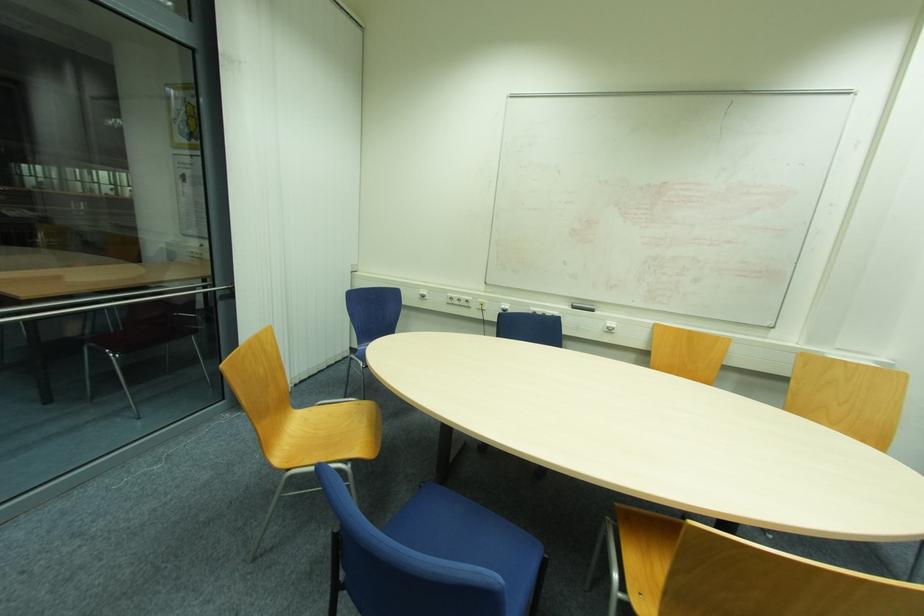
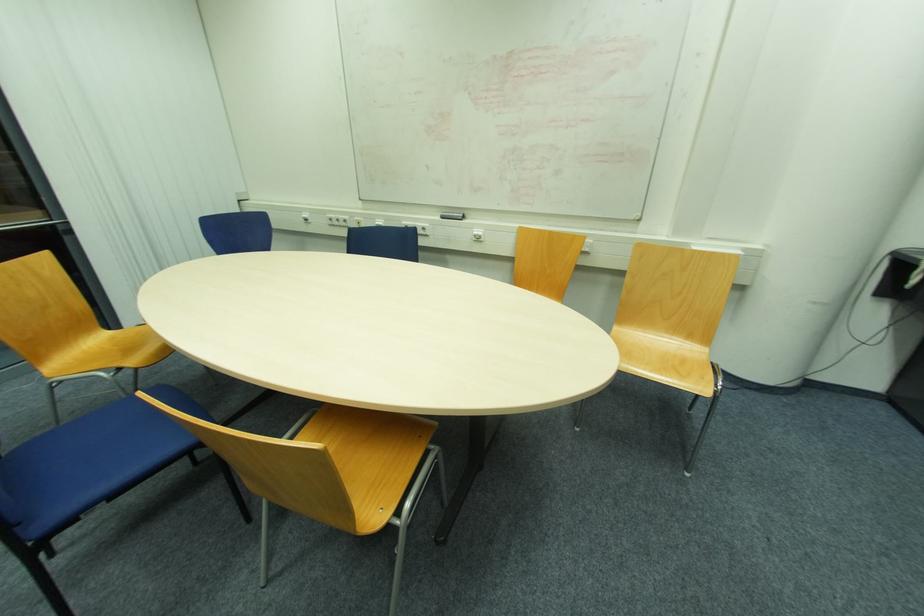
The point at [575,309] is marked in the first image. Where is the corresponding point in the second image?

(444, 217)